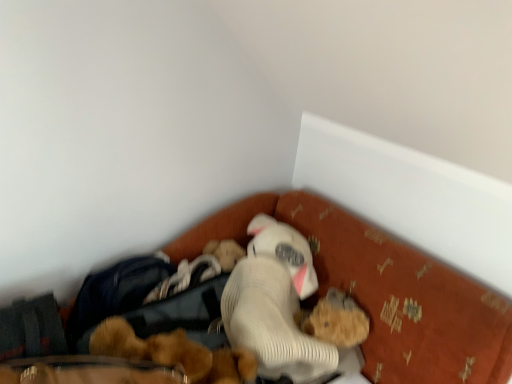
What do you see at coordinates (275, 304) in the screenshot?
I see `white ribbed plush at center` at bounding box center [275, 304].

Image resolution: width=512 pixels, height=384 pixels. I want to click on fluffy brown teddy bear at center, the second toy when ordered from right to left, so click(x=174, y=353).

Is velvet orange bed at lower center located within fuzzy brown teddy bear at lower center, acting as the second toy starting from the left?

Actually, velvet orange bed at lower center is outside fuzzy brown teddy bear at lower center, acting as the second toy starting from the left.

Considering the sizes of fuzzy brown teddy bear at lower center, placed as the 1th toy when sorted from right to left, and velvet orange bed at lower center in the image, is fuzzy brown teddy bear at lower center, placed as the 1th toy when sorted from right to left, bigger or smaller than velvet orange bed at lower center?

fuzzy brown teddy bear at lower center, placed as the 1th toy when sorted from right to left, is smaller than velvet orange bed at lower center.

Locate an element on the screen. The height and width of the screenshot is (384, 512). bed on the left of the fuzzy brown teddy bear at lower center, acting as the second toy starting from the left is located at coordinates (222, 226).

What's the angular difference between white ribbed plush at center and fuzzy brown teddy bear at lower center, placed as the 1th toy when sorted from right to left,'s facing directions?

The angular difference between white ribbed plush at center and fuzzy brown teddy bear at lower center, placed as the 1th toy when sorted from right to left, is 4.28 degrees.

Is white ribbed plush at center turned away from fuzzy brown teddy bear at lower center, placed as the 1th toy when sorted from right to left?

No, white ribbed plush at center is not facing the opposite direction of fuzzy brown teddy bear at lower center, placed as the 1th toy when sorted from right to left.

Which point is more distant from viewer, (x=315, y=279) or (x=338, y=308)?

The point (x=315, y=279) is farther from the camera.

You are a GUI agent. You are given a task and a screenshot of the screen. Output one action in this format:
    pyautogui.click(x=<x>, y=<y>)
    Task: Click on the toy that is the 1st one when counting downward from the white ribbed plush at center (from the image's perspective)
    This screenshot has height=384, width=512.
    Given the screenshot: What is the action you would take?
    pyautogui.click(x=337, y=322)

Is fluffy brown teddy bear at center, positioned as the 1th toy in left-to-right order, smaller than velvet orange bed at lower center?

Correct, fluffy brown teddy bear at center, positioned as the 1th toy in left-to-right order, occupies less space than velvet orange bed at lower center.

Which object is positioned more to the right, fluffy brown teddy bear at center, the second toy when ordered from right to left, or velvet orange bed at lower center?

Positioned to the right is velvet orange bed at lower center.

From the image's perspective, which is above, fluffy brown teddy bear at center, positioned as the 1th toy in left-to-right order, or velvet orange bed at lower center?

From the image's view, fluffy brown teddy bear at center, positioned as the 1th toy in left-to-right order, is above.

Considering the sizes of objects fluffy brown teddy bear at center, positioned as the 1th toy in left-to-right order, and velvet orange bed at lower center in the image provided, who is taller, fluffy brown teddy bear at center, positioned as the 1th toy in left-to-right order, or velvet orange bed at lower center?

velvet orange bed at lower center is taller.

Based on the photo, can you confirm if fluffy brown teddy bear at center, positioned as the 1th toy in left-to-right order, is shorter than white ribbed plush at center?

Indeed, fluffy brown teddy bear at center, positioned as the 1th toy in left-to-right order, has a lesser height compared to white ribbed plush at center.

Does fluffy brown teddy bear at center, positioned as the 1th toy in left-to-right order, touch white ribbed plush at center?

No, fluffy brown teddy bear at center, positioned as the 1th toy in left-to-right order, is not making contact with white ribbed plush at center.

From a real-world perspective, does fluffy brown teddy bear at center, positioned as the 1th toy in left-to-right order, sit lower than white ribbed plush at center?

Result: Yes, from a real-world perspective, fluffy brown teddy bear at center, positioned as the 1th toy in left-to-right order, is below white ribbed plush at center.

Is fluffy brown teddy bear at center, the second toy when ordered from right to left, thinner than white ribbed plush at center?

Indeed, fluffy brown teddy bear at center, the second toy when ordered from right to left, has a lesser width compared to white ribbed plush at center.

Which of these two, velvet orange bed at lower center or fuzzy brown teddy bear at lower center, acting as the second toy starting from the left, stands taller?

velvet orange bed at lower center is taller.

Which object is closer to the camera taking this photo, velvet orange bed at lower center or fuzzy brown teddy bear at lower center, placed as the 1th toy when sorted from right to left?

velvet orange bed at lower center is in front.

Consider the image. Measure the distance from velvet orange bed at lower center to fuzzy brown teddy bear at lower center, acting as the second toy starting from the left.

velvet orange bed at lower center and fuzzy brown teddy bear at lower center, acting as the second toy starting from the left, are 41.07 centimeters apart.

From a real-world perspective, is fluffy brown teddy bear at center, the second toy when ordered from right to left, on top of fuzzy brown teddy bear at lower center, placed as the 1th toy when sorted from right to left?

No, from a real-world perspective, fluffy brown teddy bear at center, the second toy when ordered from right to left, is not above fuzzy brown teddy bear at lower center, placed as the 1th toy when sorted from right to left.

Is fluffy brown teddy bear at center, the second toy when ordered from right to left, touching fuzzy brown teddy bear at lower center, acting as the second toy starting from the left?

No.

Does fluffy brown teddy bear at center, positioned as the 1th toy in left-to-right order, come behind fuzzy brown teddy bear at lower center, acting as the second toy starting from the left?

That is False.

Where is `toy below the fuzzy brown teddy bear at lower center, acting as the second toy starting from the left (from a real-world perspective)`? This screenshot has height=384, width=512. toy below the fuzzy brown teddy bear at lower center, acting as the second toy starting from the left (from a real-world perspective) is located at coordinates (174, 353).

Considering the relative sizes of white ribbed plush at center and fluffy brown teddy bear at center, positioned as the 1th toy in left-to-right order, in the image provided, is white ribbed plush at center thinner than fluffy brown teddy bear at center, positioned as the 1th toy in left-to-right order,?

No, white ribbed plush at center is not thinner than fluffy brown teddy bear at center, positioned as the 1th toy in left-to-right order.

Can you tell me how much white ribbed plush at center and fluffy brown teddy bear at center, the second toy when ordered from right to left, differ in facing direction?

They differ by 15.4 degrees in their facing directions.

Which of these two, white ribbed plush at center or fluffy brown teddy bear at center, the second toy when ordered from right to left, stands taller?

With more height is white ribbed plush at center.

Does white ribbed plush at center turn towards fluffy brown teddy bear at center, the second toy when ordered from right to left?

No, white ribbed plush at center does not turn towards fluffy brown teddy bear at center, the second toy when ordered from right to left.

Locate an element on the screen. This screenshot has width=512, height=384. bed in front of the fuzzy brown teddy bear at lower center, placed as the 1th toy when sorted from right to left is located at coordinates (222, 226).

From a real-world perspective, starting from the white ribbed plush at center, which toy is the 1st one below it? Please provide its 2D coordinates.

[(337, 322)]

Estimate the real-world distances between objects in this image. Which object is closer to white ribbed plush at center, fluffy brown teddy bear at center, positioned as the 1th toy in left-to-right order, or fuzzy brown teddy bear at lower center, placed as the 1th toy when sorted from right to left?

The object closer to white ribbed plush at center is fuzzy brown teddy bear at lower center, placed as the 1th toy when sorted from right to left.

When comparing their distances from white ribbed plush at center, does fuzzy brown teddy bear at lower center, acting as the second toy starting from the left, or velvet orange bed at lower center seem closer?

fuzzy brown teddy bear at lower center, acting as the second toy starting from the left, is closer to white ribbed plush at center.

Based on their spatial positions, is white ribbed plush at center or fuzzy brown teddy bear at lower center, placed as the 1th toy when sorted from right to left, closer to fluffy brown teddy bear at center, the second toy when ordered from right to left?

A: white ribbed plush at center lies closer to fluffy brown teddy bear at center, the second toy when ordered from right to left, than the other object.

From the image, which object appears to be farther from velvet orange bed at lower center, fluffy brown teddy bear at center, the second toy when ordered from right to left, or fuzzy brown teddy bear at lower center, acting as the second toy starting from the left?

fuzzy brown teddy bear at lower center, acting as the second toy starting from the left, is further to velvet orange bed at lower center.

Estimate the real-world distances between objects in this image. Which object is closer to white ribbed plush at center, velvet orange bed at lower center or fluffy brown teddy bear at center, the second toy when ordered from right to left?

fluffy brown teddy bear at center, the second toy when ordered from right to left, lies closer to white ribbed plush at center than the other object.

From the image, which object appears to be nearer to fluffy brown teddy bear at center, positioned as the 1th toy in left-to-right order, white ribbed plush at center or velvet orange bed at lower center?

Among the two, white ribbed plush at center is located nearer to fluffy brown teddy bear at center, positioned as the 1th toy in left-to-right order.

From the image, which object appears to be nearer to velvet orange bed at lower center, fluffy brown teddy bear at center, the second toy when ordered from right to left, or white ribbed plush at center?

white ribbed plush at center is positioned closer to the anchor velvet orange bed at lower center.

Estimate the real-world distances between objects in this image. Which object is further from fluffy brown teddy bear at center, the second toy when ordered from right to left, fuzzy brown teddy bear at lower center, placed as the 1th toy when sorted from right to left, or velvet orange bed at lower center?

The object further to fluffy brown teddy bear at center, the second toy when ordered from right to left, is velvet orange bed at lower center.

Locate an element on the screen. animal between velvet orange bed at lower center and fluffy brown teddy bear at center, the second toy when ordered from right to left, along the z-axis is located at coordinates (275, 304).

The height and width of the screenshot is (384, 512). Find the location of `toy located between velvet orange bed at lower center and fuzzy brown teddy bear at lower center, acting as the second toy starting from the left, in the depth direction`. toy located between velvet orange bed at lower center and fuzzy brown teddy bear at lower center, acting as the second toy starting from the left, in the depth direction is located at coordinates (174, 353).

Locate an element on the screen. This screenshot has height=384, width=512. animal between velvet orange bed at lower center and fuzzy brown teddy bear at lower center, acting as the second toy starting from the left, from front to back is located at coordinates (275, 304).

You are a GUI agent. You are given a task and a screenshot of the screen. Output one action in this format:
    pyautogui.click(x=<x>, y=<y>)
    Task: Click on the animal between fluffy brown teddy bear at center, positioned as the 1th toy in left-to-right order, and fuzzy brown teddy bear at lower center, acting as the second toy starting from the left, in the horizontal direction
    The width and height of the screenshot is (512, 384).
    Given the screenshot: What is the action you would take?
    pyautogui.click(x=275, y=304)